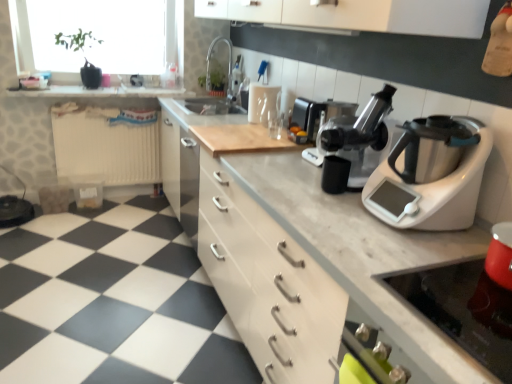
You are a GUI agent. You are given a task and a screenshot of the screen. Output one action in this format:
    pyautogui.click(x=<x>, y=<y>)
    Task: Click on the vacant point to the left of sleek silver coffee machine at center
    This screenshot has width=512, height=384.
    Given the screenshot: What is the action you would take?
    pyautogui.click(x=282, y=153)